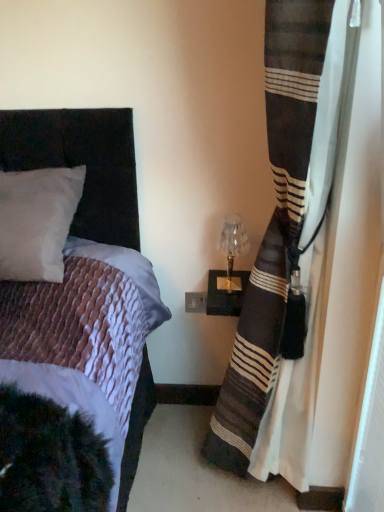
Question: From the image's perspective, is striped fabric curtain at right positioned above or below translucent glass table lamp at upper right?

Choices:
 (A) below
 (B) above

Answer: (A)

Question: From a real-world perspective, relative to translucent glass table lamp at upper right, is striped fabric curtain at right vertically above or below?

Choices:
 (A) above
 (B) below

Answer: (A)

Question: Based on their sizes in the image, would you say striped fabric curtain at right is bigger or smaller than translucent glass table lamp at upper right?

Choices:
 (A) small
 (B) big

Answer: (B)

Question: In terms of height, does translucent glass table lamp at upper right look taller or shorter compared to striped fabric curtain at right?

Choices:
 (A) short
 (B) tall

Answer: (A)

Question: Considering the positions of translucent glass table lamp at upper right and striped fabric curtain at right in the image, is translucent glass table lamp at upper right bigger or smaller than striped fabric curtain at right?

Choices:
 (A) big
 (B) small

Answer: (B)

Question: From a real-world perspective, is translucent glass table lamp at upper right positioned above or below striped fabric curtain at right?

Choices:
 (A) above
 (B) below

Answer: (B)

Question: Is translucent glass table lamp at upper right situated inside striped fabric curtain at right or outside?

Choices:
 (A) outside
 (B) inside

Answer: (A)